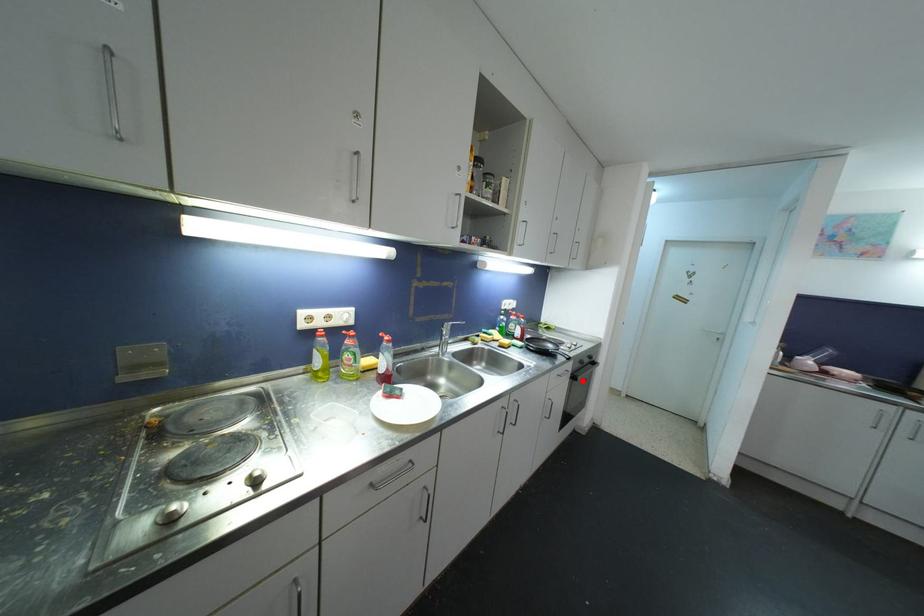
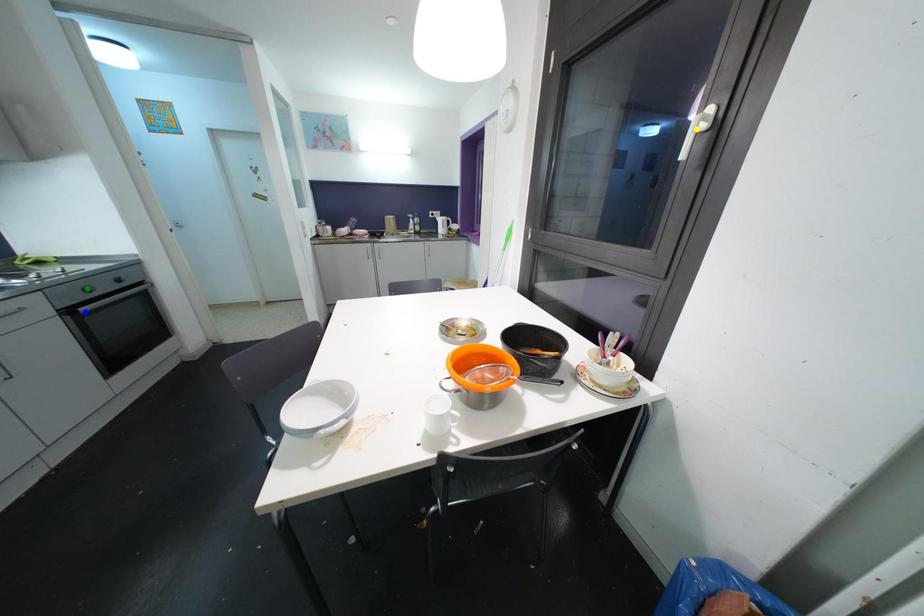
Question: I am providing you with two images of the same scene from different viewpoints. A red point is marked on the first image. You are given multiple points on the second image. In image 2, which mark is for the same physical point as the one in image 1?

Choices:
 (A) green point
 (B) blue point
 (C) yellow point

Answer: (B)